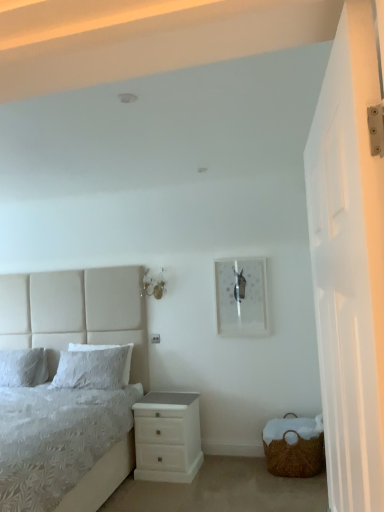
Question: Does white glossy door at right have a larger size compared to white soft pillow at left, marked as the 1th pillow in a left-to-right arrangement?

Choices:
 (A) yes
 (B) no

Answer: (A)

Question: Is white glossy door at right to the right of white soft pillow at left, marked as the 1th pillow in a left-to-right arrangement, from the viewer's perspective?

Choices:
 (A) yes
 (B) no

Answer: (A)

Question: Can you see white glossy door at right touching white soft pillow at left, the 2th pillow in the right-to-left sequence?

Choices:
 (A) yes
 (B) no

Answer: (B)

Question: Is white glossy door at right oriented away from white soft pillow at left, marked as the 1th pillow in a left-to-right arrangement?

Choices:
 (A) yes
 (B) no

Answer: (B)

Question: Considering the relative sizes of white glossy door at right and white soft pillow at left, the 2th pillow in the right-to-left sequence, in the image provided, is white glossy door at right smaller than white soft pillow at left, the 2th pillow in the right-to-left sequence,?

Choices:
 (A) no
 (B) yes

Answer: (A)

Question: Based on their sizes in the image, would you say white soft pillow at left, the 2th pillow in the right-to-left sequence, is bigger or smaller than woven brown basket at lower right?

Choices:
 (A) small
 (B) big

Answer: (A)

Question: From the image's perspective, is white soft pillow at left, the 2th pillow in the right-to-left sequence, positioned above or below woven brown basket at lower right?

Choices:
 (A) below
 (B) above

Answer: (B)

Question: In the image, is white soft pillow at left, the 2th pillow in the right-to-left sequence, positioned in front of or behind woven brown basket at lower right?

Choices:
 (A) behind
 (B) front

Answer: (A)

Question: Looking at their shapes, would you say white soft pillow at left, the 2th pillow in the right-to-left sequence, is wider or thinner than woven brown basket at lower right?

Choices:
 (A) thin
 (B) wide

Answer: (A)

Question: In terms of width, does white fabric bed at left look wider or thinner when compared to white soft pillow at left, which is the second pillow in left-to-right order?

Choices:
 (A) wide
 (B) thin

Answer: (A)

Question: In terms of height, does white fabric bed at left look taller or shorter compared to white soft pillow at left, which is the second pillow in left-to-right order?

Choices:
 (A) short
 (B) tall

Answer: (B)

Question: Does point (122, 457) appear closer or farther from the camera than point (114, 369)?

Choices:
 (A) farther
 (B) closer

Answer: (B)

Question: Considering the relative positions of white fabric bed at left and white soft pillow at left, which is the second pillow in left-to-right order, in the image provided, is white fabric bed at left to the left or to the right of white soft pillow at left, which is the second pillow in left-to-right order,?

Choices:
 (A) right
 (B) left

Answer: (B)

Question: Does point (314, 442) appear closer or farther from the camera than point (162, 446)?

Choices:
 (A) farther
 (B) closer

Answer: (B)

Question: Considering their positions, is woven brown basket at lower right located in front of or behind white glossy chest of drawers at lower right?

Choices:
 (A) front
 (B) behind

Answer: (A)